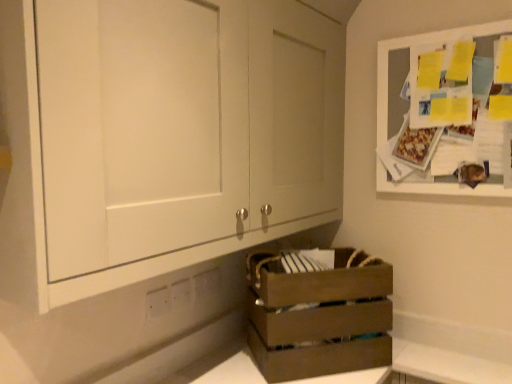
This screenshot has height=384, width=512. Describe the element at coordinates (157, 302) in the screenshot. I see `white plastic electric outlet at lower center, which is the third electric outlet from back to front` at that location.

What do you see at coordinates (161, 136) in the screenshot?
I see `matte white cabinet at center, placed as the second cabinetry when sorted from right to left` at bounding box center [161, 136].

Locate an element on the screen. white wood board at upper right, the 2th cabinetry when ordered from left to right is located at coordinates (411, 46).

Based on the photo, what is the approximate height of brown wooden crate at lower center?

brown wooden crate at lower center is 13.50 inches in height.

This screenshot has height=384, width=512. Find the location of `white plastic electric outlet at lower center, acting as the 2th electric outlet starting from the right`. white plastic electric outlet at lower center, acting as the 2th electric outlet starting from the right is located at coordinates (180, 293).

Is there a large distance between white plastic electric outlet at lower center, placed as the 3th electric outlet when sorted from front to back, and brown wooden crate at lower center?

Actually, white plastic electric outlet at lower center, placed as the 3th electric outlet when sorted from front to back, and brown wooden crate at lower center are a little close together.

Considering the relative positions of white plastic electric outlet at lower center, placed as the 1th electric outlet when sorted from right to left, and brown wooden crate at lower center in the image provided, is white plastic electric outlet at lower center, placed as the 1th electric outlet when sorted from right to left, to the left of brown wooden crate at lower center from the viewer's perspective?

Yes.

Identify the location of electric outlet that is the 3rd one when counting backward from the brown wooden crate at lower center. This screenshot has height=384, width=512. (207, 283).

Who is smaller, white plastic electric outlet at lower center, placed as the 3th electric outlet when sorted from front to back, or white plastic electric outlet at lower center, which is the third electric outlet from back to front?

With smaller size is white plastic electric outlet at lower center, which is the third electric outlet from back to front.

Is white plastic electric outlet at lower center, the first electric outlet positioned from the back, at the left side of white plastic electric outlet at lower center, the 3th electric outlet positioned from the right?

Incorrect, white plastic electric outlet at lower center, the first electric outlet positioned from the back, is not on the left side of white plastic electric outlet at lower center, the 3th electric outlet positioned from the right.

Which is in front, white plastic electric outlet at lower center, which is the 3th electric outlet in left-to-right order, or white plastic electric outlet at lower center, which ranks as the first electric outlet in front-to-back order?

white plastic electric outlet at lower center, which ranks as the first electric outlet in front-to-back order, is more forward.

Is white plastic electric outlet at lower center, which is the 3th electric outlet in left-to-right order, looking in the opposite direction of white plastic electric outlet at lower center, the 1th electric outlet viewed from the left?

No, white plastic electric outlet at lower center, which is the 3th electric outlet in left-to-right order,'s orientation is not away from white plastic electric outlet at lower center, the 1th electric outlet viewed from the left.

Is white plastic electric outlet at lower center, which is the third electric outlet from back to front, in front of white plastic electric outlet at lower center, which is the 3th electric outlet in left-to-right order?

That is True.

Does point (147, 294) appear closer or farther from the camera than point (205, 275)?

Point (147, 294).

Which of these two, white plastic electric outlet at lower center, the 3th electric outlet positioned from the right, or white plastic electric outlet at lower center, the first electric outlet positioned from the back, is bigger?

With larger size is white plastic electric outlet at lower center, the first electric outlet positioned from the back.

Is white plastic electric outlet at lower center, the 1th electric outlet viewed from the left, beside white plastic electric outlet at lower center, placed as the 3th electric outlet when sorted from front to back?

No, white plastic electric outlet at lower center, the 1th electric outlet viewed from the left, is not touching white plastic electric outlet at lower center, placed as the 3th electric outlet when sorted from front to back.

Is white wood board at upper right, the 2th cabinetry when ordered from left to right, inside the boundaries of matte white cabinet at center, the 1th cabinetry in the left-to-right sequence, or outside?

white wood board at upper right, the 2th cabinetry when ordered from left to right, is not inside matte white cabinet at center, the 1th cabinetry in the left-to-right sequence, it's outside.

How far apart are white wood board at upper right, the 2th cabinetry when ordered from left to right, and matte white cabinet at center, the 1th cabinetry in the left-to-right sequence?

white wood board at upper right, the 2th cabinetry when ordered from left to right, and matte white cabinet at center, the 1th cabinetry in the left-to-right sequence, are 28.31 inches apart.

From a real-world perspective, which object rests below the other?

From a 3D spatial view, white wood board at upper right, the 2th cabinetry when ordered from left to right, is below.

Based on the photo, does white wood board at upper right, which is the 1th cabinetry in right-to-left order, have a greater height compared to matte white cabinet at center, the 1th cabinetry in the left-to-right sequence?

In fact, white wood board at upper right, which is the 1th cabinetry in right-to-left order, may be shorter than matte white cabinet at center, the 1th cabinetry in the left-to-right sequence.

Considering the sizes of objects brown wooden crate at lower center and white plastic electric outlet at lower center, the second electric outlet viewed from the left, in the image provided, who is smaller, brown wooden crate at lower center or white plastic electric outlet at lower center, the second electric outlet viewed from the left,?

Smaller between the two is white plastic electric outlet at lower center, the second electric outlet viewed from the left.

Does brown wooden crate at lower center appear on the right side of white plastic electric outlet at lower center, acting as the 2th electric outlet starting from the right?

Correct, you'll find brown wooden crate at lower center to the right of white plastic electric outlet at lower center, acting as the 2th electric outlet starting from the right.

Considering the relative sizes of brown wooden crate at lower center and white plastic electric outlet at lower center, the second electric outlet viewed from the left, in the image provided, is brown wooden crate at lower center wider than white plastic electric outlet at lower center, the second electric outlet viewed from the left,?

Correct, the width of brown wooden crate at lower center exceeds that of white plastic electric outlet at lower center, the second electric outlet viewed from the left.

From a real-world perspective, is brown wooden crate at lower center beneath white plastic electric outlet at lower center, the second electric outlet when ordered from back to front?

Yes, from a real-world perspective, brown wooden crate at lower center is below white plastic electric outlet at lower center, the second electric outlet when ordered from back to front.

Between white plastic electric outlet at lower center, acting as the 2th electric outlet starting from the right, and brown wooden crate at lower center, which one is positioned in front?

brown wooden crate at lower center is in front.

Which is farther from the camera, (184, 281) or (265, 372)?

The point (184, 281) is more distant.

Considering the relative sizes of white plastic electric outlet at lower center, the second electric outlet when ordered from back to front, and brown wooden crate at lower center in the image provided, is white plastic electric outlet at lower center, the second electric outlet when ordered from back to front, shorter than brown wooden crate at lower center?

Yes.

Based on the photo, does white plastic electric outlet at lower center, the 3th electric outlet positioned from the right, have a greater width compared to white plastic electric outlet at lower center, which is the 2th electric outlet from front to back?

No.

Is white plastic electric outlet at lower center, which is the third electric outlet from back to front, oriented towards white plastic electric outlet at lower center, which is the 2th electric outlet from front to back?

No, white plastic electric outlet at lower center, which is the third electric outlet from back to front, is not turned towards white plastic electric outlet at lower center, which is the 2th electric outlet from front to back.

Considering the sizes of objects white plastic electric outlet at lower center, the 3th electric outlet positioned from the right, and white plastic electric outlet at lower center, the second electric outlet viewed from the left, in the image provided, who is shorter, white plastic electric outlet at lower center, the 3th electric outlet positioned from the right, or white plastic electric outlet at lower center, the second electric outlet viewed from the left,?

white plastic electric outlet at lower center, the second electric outlet viewed from the left.

From the image's perspective, is white plastic electric outlet at lower center, the 3th electric outlet positioned from the right, under white plastic electric outlet at lower center, acting as the 2th electric outlet starting from the right?

Correct, white plastic electric outlet at lower center, the 3th electric outlet positioned from the right, appears lower than white plastic electric outlet at lower center, acting as the 2th electric outlet starting from the right, in the image.

You are a GUI agent. You are given a task and a screenshot of the screen. Output one action in this format:
    pyautogui.click(x=<x>, y=<y>)
    Task: Click on the crate in front of the white plastic electric outlet at lower center, placed as the 3th electric outlet when sorted from front to back
    Image resolution: width=512 pixels, height=384 pixels.
    Given the screenshot: What is the action you would take?
    pyautogui.click(x=318, y=314)

The width and height of the screenshot is (512, 384). What are the coordinates of `the 2nd electric outlet behind the white plastic electric outlet at lower center, which ranks as the first electric outlet in front-to-back order, counting from the anchor's position` in the screenshot? It's located at (207, 283).

Considering their positions, is white plastic electric outlet at lower center, the second electric outlet viewed from the left, positioned closer to brown wooden crate at lower center than white wood board at upper right, which is the 1th cabinetry in right-to-left order?

white plastic electric outlet at lower center, the second electric outlet viewed from the left, lies closer to brown wooden crate at lower center than the other object.

Looking at the image, which one is located further to matte white cabinet at center, placed as the second cabinetry when sorted from right to left, white plastic electric outlet at lower center, which is the 2th electric outlet from front to back, or white plastic electric outlet at lower center, the 3th electric outlet positioned from the right?

white plastic electric outlet at lower center, which is the 2th electric outlet from front to back, lies further to matte white cabinet at center, placed as the second cabinetry when sorted from right to left, than the other object.

From the image, which object appears to be nearer to matte white cabinet at center, placed as the second cabinetry when sorted from right to left, white plastic electric outlet at lower center, which is the 2th electric outlet from front to back, or white wood board at upper right, which is the 1th cabinetry in right-to-left order?

white plastic electric outlet at lower center, which is the 2th electric outlet from front to back, lies closer to matte white cabinet at center, placed as the second cabinetry when sorted from right to left, than the other object.

From the image, which object appears to be nearer to brown wooden crate at lower center, white wood board at upper right, the 2th cabinetry when ordered from left to right, or white plastic electric outlet at lower center, the 1th electric outlet viewed from the left?

Based on the image, white plastic electric outlet at lower center, the 1th electric outlet viewed from the left, appears to be nearer to brown wooden crate at lower center.

From the picture: Looking at the image, which one is located further to white plastic electric outlet at lower center, the first electric outlet positioned from the back, white plastic electric outlet at lower center, the 1th electric outlet viewed from the left, or matte white cabinet at center, placed as the second cabinetry when sorted from right to left?

Among the two, matte white cabinet at center, placed as the second cabinetry when sorted from right to left, is located further to white plastic electric outlet at lower center, the first electric outlet positioned from the back.

Considering their positions, is white plastic electric outlet at lower center, the second electric outlet viewed from the left, positioned further to matte white cabinet at center, the 1th cabinetry in the left-to-right sequence, than white plastic electric outlet at lower center, placed as the 3th electric outlet when sorted from front to back?

white plastic electric outlet at lower center, placed as the 3th electric outlet when sorted from front to back, is further to matte white cabinet at center, the 1th cabinetry in the left-to-right sequence.

Looking at the image, which one is located closer to white plastic electric outlet at lower center, which is the third electric outlet from back to front, white plastic electric outlet at lower center, which is the 2th electric outlet from front to back, or white plastic electric outlet at lower center, the first electric outlet positioned from the back?

The object closer to white plastic electric outlet at lower center, which is the third electric outlet from back to front, is white plastic electric outlet at lower center, which is the 2th electric outlet from front to back.

Considering their positions, is white plastic electric outlet at lower center, the first electric outlet positioned from the back, positioned closer to white plastic electric outlet at lower center, the second electric outlet viewed from the left, than white plastic electric outlet at lower center, the 3th electric outlet positioned from the right?

white plastic electric outlet at lower center, the 3th electric outlet positioned from the right.

You are a GUI agent. You are given a task and a screenshot of the screen. Output one action in this format:
    pyautogui.click(x=<x>, y=<y>)
    Task: Click on the electric outlet located between white plastic electric outlet at lower center, the 1th electric outlet viewed from the left, and white plastic electric outlet at lower center, which is the 3th electric outlet in left-to-right order, in the depth direction
    
    Given the screenshot: What is the action you would take?
    (180, 293)

Identify the location of crate between matte white cabinet at center, the 1th cabinetry in the left-to-right sequence, and white plastic electric outlet at lower center, placed as the 3th electric outlet when sorted from front to back, along the z-axis. (318, 314).

The width and height of the screenshot is (512, 384). Find the location of `electric outlet between matte white cabinet at center, placed as the second cabinetry when sorted from right to left, and white plastic electric outlet at lower center, acting as the 2th electric outlet starting from the right, along the z-axis`. electric outlet between matte white cabinet at center, placed as the second cabinetry when sorted from right to left, and white plastic electric outlet at lower center, acting as the 2th electric outlet starting from the right, along the z-axis is located at coordinates (157, 302).

This screenshot has height=384, width=512. What are the coordinates of `crate between white plastic electric outlet at lower center, placed as the 3th electric outlet when sorted from front to back, and white wood board at upper right, the 2th cabinetry when ordered from left to right` in the screenshot? It's located at (318, 314).